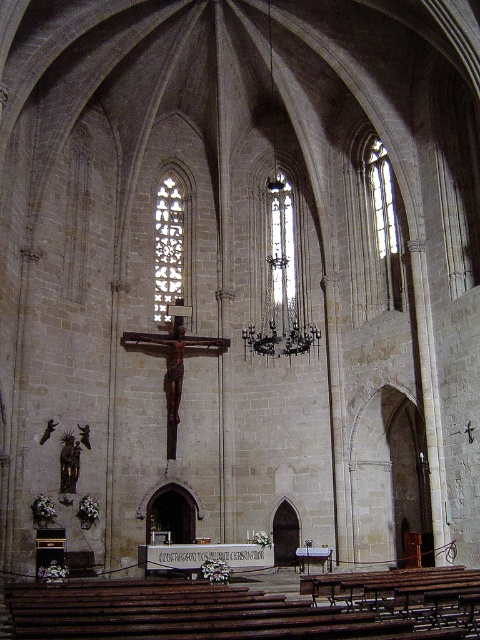
Can you confirm if clear glass stained glass window at center is positioned above clear glass window at center?

Indeed, clear glass stained glass window at center is positioned over clear glass window at center.

Consider the image. Can you confirm if clear glass stained glass window at center is smaller than clear glass window at center?

No.

This screenshot has height=640, width=480. Find the location of `clear glass stained glass window at center`. clear glass stained glass window at center is located at coordinates (168, 248).

You are a GUI agent. You are given a task and a screenshot of the screen. Output one action in this format:
    pyautogui.click(x=<x>, y=<y>)
    Task: Click on the clear glass stained glass window at center
    The height and width of the screenshot is (640, 480).
    Given the screenshot: What is the action you would take?
    pyautogui.click(x=168, y=248)

Can you confirm if clear glass stained glass window at center is positioned below clear glass window at upper right?

Correct, clear glass stained glass window at center is located below clear glass window at upper right.

Who is more distant from viewer, (169,275) or (384,150)?

Positioned behind is point (169,275).

In order to click on clear glass stained glass window at center in this screenshot , I will do `click(168, 248)`.

Can you confirm if dark bronze chandelier at center is positioned to the left of clear glass window at center?

Incorrect, dark bronze chandelier at center is not on the left side of clear glass window at center.

Is dark bronze chandelier at center shorter than clear glass window at center?

No, dark bronze chandelier at center is not shorter than clear glass window at center.

This screenshot has width=480, height=640. What do you see at coordinates (280, 284) in the screenshot? I see `dark bronze chandelier at center` at bounding box center [280, 284].

At what (x,y) coordinates should I click in order to perform the action: click on dark bronze chandelier at center. Please return your answer as a coordinate pair (x, y). The height and width of the screenshot is (640, 480). Looking at the image, I should click on (280, 284).